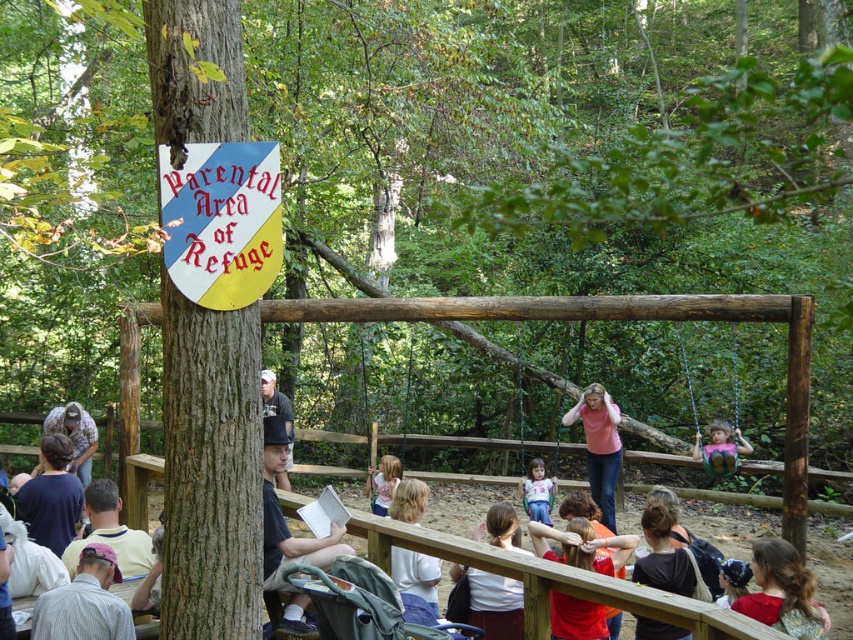
Which of these two, pink matte shirt at center or light pink fabric dress at center, stands taller?

Standing taller between the two is pink matte shirt at center.

Does point (583, 396) come in front of point (376, 481)?

Yes, it is.

The height and width of the screenshot is (640, 853). What do you see at coordinates (599, 445) in the screenshot?
I see `pink matte shirt at center` at bounding box center [599, 445].

At what (x,y) coordinates should I click in order to perform the action: click on pink matte shirt at center. Please return your answer as a coordinate pair (x, y). The width and height of the screenshot is (853, 640). Looking at the image, I should click on (599, 445).

Is yellow and blue shield at upper left positioned before matte black shirt at upper center?

Yes, yellow and blue shield at upper left is in front of matte black shirt at upper center.

Can you confirm if yellow and blue shield at upper left is wider than matte black shirt at upper center?

Indeed, yellow and blue shield at upper left has a greater width compared to matte black shirt at upper center.

Which is behind, point (235, 262) or point (262, 397)?

Positioned behind is point (262, 397).

Where is `yellow and blue shield at upper left`? yellow and blue shield at upper left is located at coordinates (221, 221).

Which of these two, yellow and blue shield at upper left or matte pink swing at center, stands shorter?

With less height is matte pink swing at center.

Can you confirm if yellow and blue shield at upper left is wider than matte pink swing at center?

Yes.

Who is more forward, (268, 154) or (703, 451)?

Point (268, 154) is in front.

Where is `yellow and blue shield at upper left`? The image size is (853, 640). yellow and blue shield at upper left is located at coordinates (221, 221).